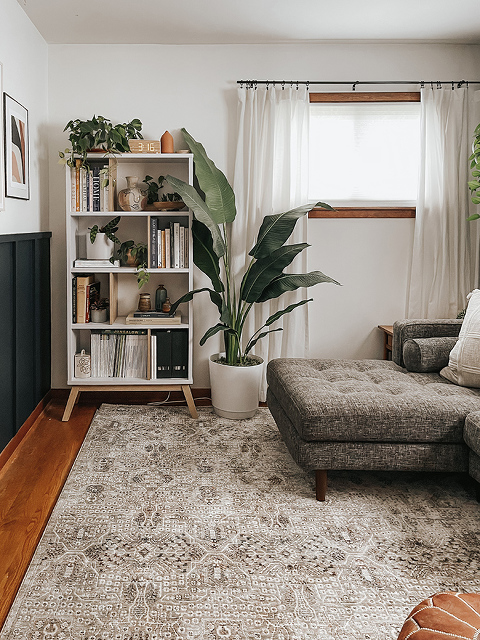
At what (x,y) coordinates should I click in order to perform the action: click on pillow. Please return your answer as a coordinate pair (x, y). The height and width of the screenshot is (640, 480). Looking at the image, I should click on (461, 348).